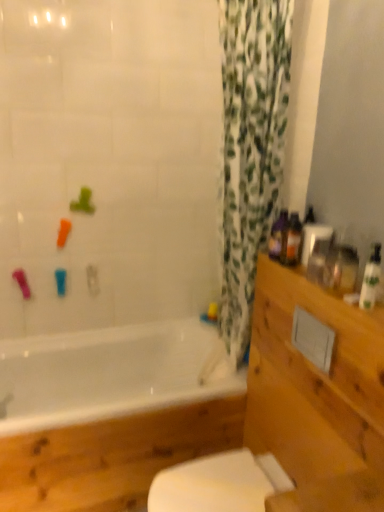
Question: Does white glossy toilet at lower center appear on the left side of translucent plastic bottles at upper right, which appears as the second toiletry when viewed from the front?

Choices:
 (A) yes
 (B) no

Answer: (A)

Question: Does white glossy toilet at lower center contain translucent plastic bottles at upper right, placed as the second toiletry when sorted from left to right?

Choices:
 (A) yes
 (B) no

Answer: (B)

Question: Is white glossy toilet at lower center positioned beyond the bounds of translucent plastic bottles at upper right, the second toiletry viewed from the right?

Choices:
 (A) yes
 (B) no

Answer: (A)

Question: Is white glossy toilet at lower center closer to camera compared to translucent plastic bottles at upper right, which appears as the second toiletry when viewed from the front?

Choices:
 (A) yes
 (B) no

Answer: (A)

Question: From a real-world perspective, is white glossy toilet at lower center under translucent plastic bottles at upper right, the second toiletry viewed from the right?

Choices:
 (A) no
 (B) yes

Answer: (B)

Question: Can you confirm if white glossy toilet at lower center is bigger than translucent plastic bottles at upper right, the 2th toiletry when ordered from back to front?

Choices:
 (A) no
 (B) yes

Answer: (B)

Question: Is white glossy bottle at right, the third toiletry in the left-to-right sequence, completely or partially outside of translucent plastic bottles at upper right, the 2th toiletry when ordered from back to front?

Choices:
 (A) yes
 (B) no

Answer: (A)

Question: From the image's perspective, is white glossy bottle at right, the 3th toiletry viewed from the back, on translucent plastic bottles at upper right, which appears as the second toiletry when viewed from the front?

Choices:
 (A) yes
 (B) no

Answer: (B)

Question: From a real-world perspective, is white glossy bottle at right, the first toiletry viewed from the front, positioned over translucent plastic bottles at upper right, the 2th toiletry when ordered from back to front, based on gravity?

Choices:
 (A) yes
 (B) no

Answer: (B)

Question: Is translucent plastic bottles at upper right, the 2th toiletry when ordered from back to front, inside white glossy bottle at right, the 3th toiletry viewed from the back?

Choices:
 (A) yes
 (B) no

Answer: (B)

Question: Does white glossy bottle at right, the first toiletry viewed from the right, have a lesser width compared to translucent plastic bottles at upper right, which appears as the second toiletry when viewed from the front?

Choices:
 (A) no
 (B) yes

Answer: (B)

Question: Does white glossy bottle at right, the third toiletry in the left-to-right sequence, come behind translucent plastic bottles at upper right, which appears as the second toiletry when viewed from the front?

Choices:
 (A) no
 (B) yes

Answer: (A)

Question: Is white glossy bathtub at lower left positioned far away from translucent plastic bottle at right, which appears as the 3th toiletry when viewed from the front?

Choices:
 (A) no
 (B) yes

Answer: (A)